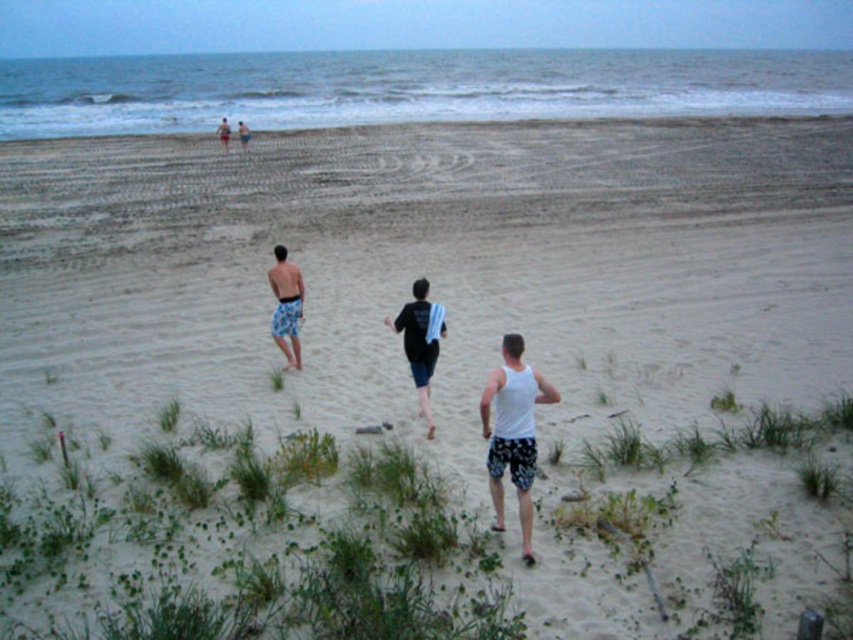
Question: Which object appears farthest from the camera in this image?

Choices:
 (A) blue shorts at center
 (B) dark blue denim shorts at center
 (C) white tank top at center
 (D) blue printed shorts at center

Answer: (A)

Question: Is white tank top at center smaller than blue shorts at center?

Choices:
 (A) yes
 (B) no

Answer: (A)

Question: Among these points, which one is farthest from the camera?

Choices:
 (A) (541, 401)
 (B) (409, 317)

Answer: (B)

Question: Is blue printed shorts at center wider than light blue shorts at upper left?

Choices:
 (A) no
 (B) yes

Answer: (A)

Question: Based on their relative distances, which object is farther from the blue shorts at center?

Choices:
 (A) dark blue denim shorts at center
 (B) light blue shorts at upper left
 (C) blue printed shorts at center
 (D) white tank top at center

Answer: (D)

Question: Is blue printed shorts at center bigger than light blue shorts at upper left?

Choices:
 (A) no
 (B) yes

Answer: (A)